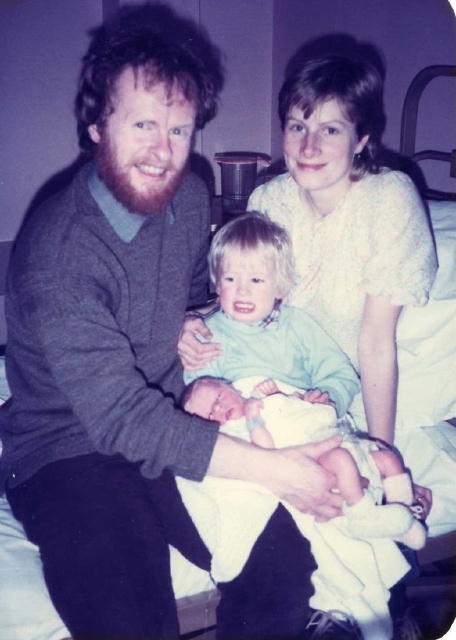
You are a photographer setting up for a family photo. You need to ensure that the light green fabric baby at center is visible above the white dotted blouse at upper center. Based on their heights, is this possible?

The light green fabric baby at center has a lesser height compared to the white dotted blouse at upper center, so it cannot be seen above the blouse.

You are a photographer trying to decide which baby to focus on for a closeup shot. The light green fabric baby at center and the white clothed baby at center are both in the frame. Based on their sizes, which baby would require a closer focus to fill the frame?

The light green fabric baby at center is thinner than the white clothed baby at center, so the photographer should focus on the light green fabric baby at center because its smaller size would need a closer focus to fill the frame.